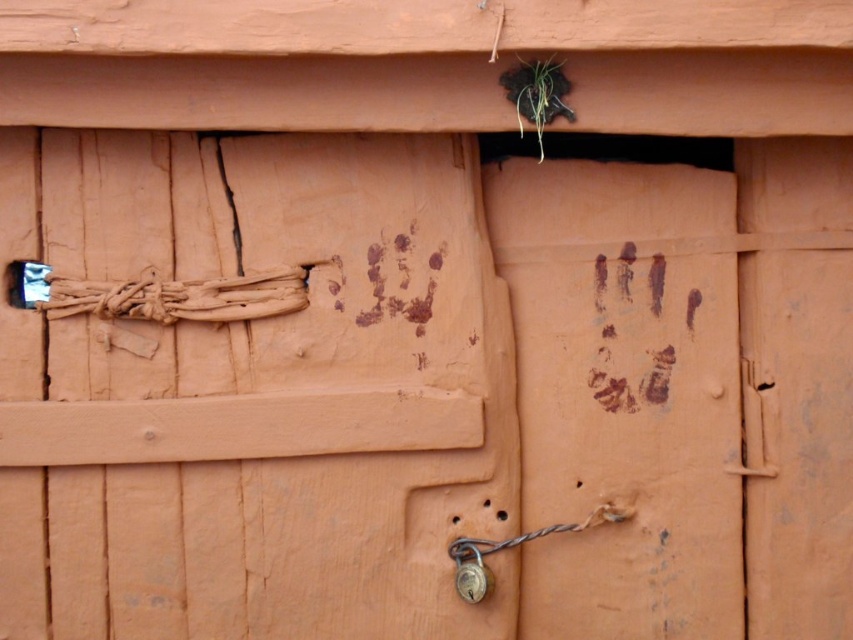
You are standing in front of a weathered wooden door. There are two points marked on the door, one at coordinate point [142,195] and another at point [480,561]. Which point is closer to you?

Point [142,195] is further to the camera than point [480,561]. Therefore, point [480,561] is closer to you.

You are a locksmith trying to open the door. You see the brown rope at left and the metallic padlock at center. Which object is higher in position?

The brown rope at left is above the metallic padlock at center, so the brown rope at left is higher in position.